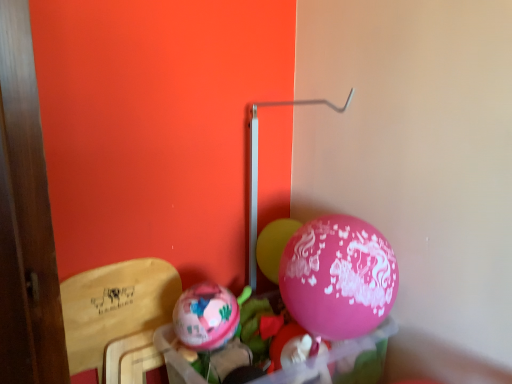
Question: Considering the positions of pink glossy balloon at center, acting as the 2th balloon starting from the left, and wooden armchair at left in the image, is pink glossy balloon at center, acting as the 2th balloon starting from the left, bigger or smaller than wooden armchair at left?

Choices:
 (A) big
 (B) small

Answer: (B)

Question: From the image's perspective, is pink glossy balloon at center, arranged as the first balloon when viewed from the right, located above or below wooden armchair at left?

Choices:
 (A) above
 (B) below

Answer: (A)

Question: Estimate the real-world distances between objects in this image. Which object is closer to the matte pink balloon at center, positioned as the second balloon in right-to-left order?

Choices:
 (A) wooden armchair at left
 (B) pink glossy balloon at center, acting as the 2th balloon starting from the left

Answer: (A)

Question: Considering the real-world distances, which object is farthest from the matte pink balloon at center, the 2th balloon when ordered from back to front?

Choices:
 (A) wooden armchair at left
 (B) pink glossy balloon at center, acting as the 2th balloon starting from the left

Answer: (B)